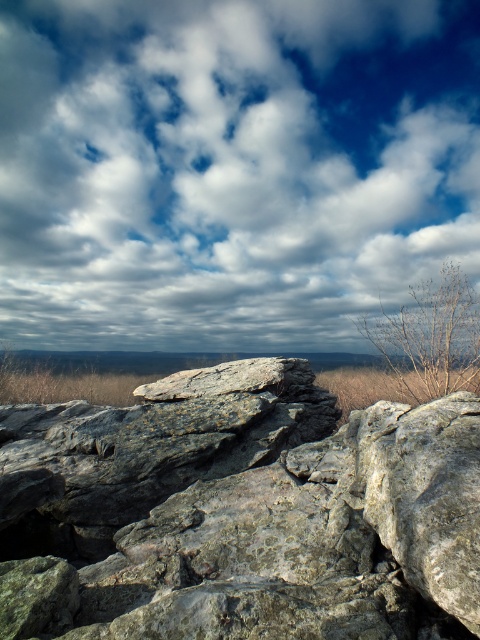
Who is more distant from viewer, (106,355) or (336,392)?

The point (106,355) is behind.

Which is more to the right, gray rock at center or brown dry grass at right?

brown dry grass at right

Is point (48, 360) positioned in front of point (372, 392)?

No, it is not.

The width and height of the screenshot is (480, 640). In order to click on gray rock at center in this screenshot , I will do `click(118, 360)`.

Is cloudy sky at upper center taller than brown dry weed at upper right?

Yes.

Locate an element on the screen. The height and width of the screenshot is (640, 480). cloudy sky at upper center is located at coordinates (230, 168).

Can you confirm if cloudy sky at upper center is bigger than gray rock at center?

Indeed, cloudy sky at upper center has a larger size compared to gray rock at center.

Between point (84, 348) and point (49, 368), which one is positioned behind?

The point (84, 348) is more distant.

Which is behind, point (294, 65) or point (184, 365)?

The point (294, 65) is more distant.

Where is `cloudy sky at upper center`? This screenshot has width=480, height=640. cloudy sky at upper center is located at coordinates (230, 168).